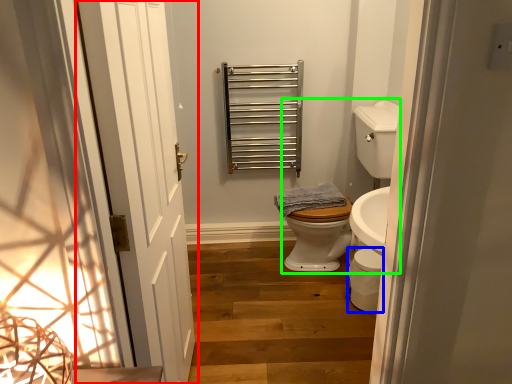
Question: Estimate the real-world distances between objects in this image. Which object is closer to door (highlighted by a red box), toilet bowl (highlighted by a blue box) or sink (highlighted by a green box)?

Choices:
 (A) toilet bowl
 (B) sink

Answer: (A)